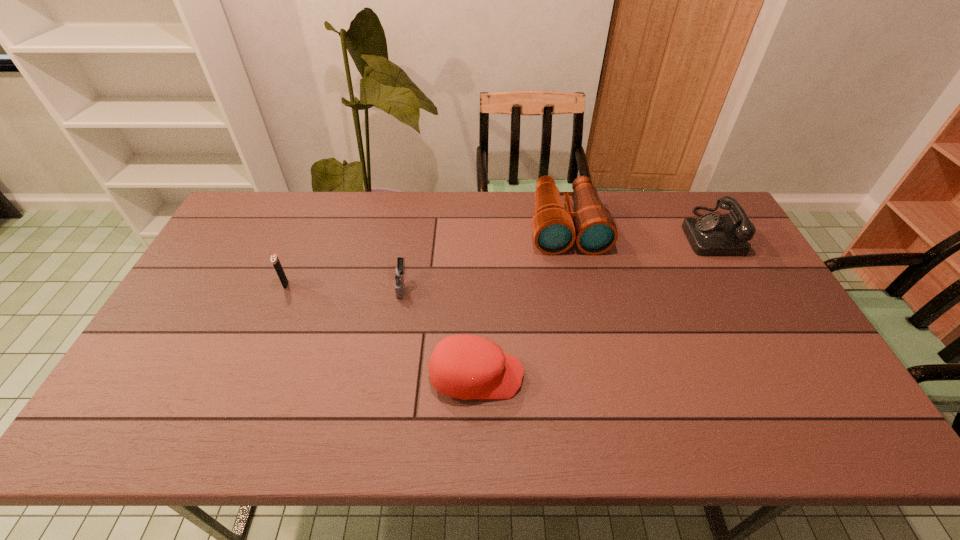
Image resolution: width=960 pixels, height=540 pixels. What are the coordinates of `vacant space situated 0.260m on the front of the leftmost object` in the screenshot? It's located at (252, 364).

The image size is (960, 540). Find the location of `vacant region located 0.190m on the back of the right igniter`. vacant region located 0.190m on the back of the right igniter is located at coordinates [411, 233].

Locate an element on the screen. free space located on the front-facing side of the nearest object is located at coordinates [543, 376].

You are a GUI agent. You are given a task and a screenshot of the screen. Output one action in this format:
    pyautogui.click(x=<x>, y=<y>)
    Task: Click on the binoculars at the far edge
    This screenshot has height=540, width=960.
    Given the screenshot: What is the action you would take?
    pyautogui.click(x=555, y=229)

Identify the location of telephone situated at the far edge. The width and height of the screenshot is (960, 540). (710, 234).

Where is `object positioned at the right edge`? object positioned at the right edge is located at coordinates (710, 234).

At what (x,y) coordinates should I click in order to perform the action: click on object positioned at the far right corner. Please return your answer as a coordinate pair (x, y). Looking at the image, I should click on (710, 234).

In the image, there is a desktop. Where is `vacant space at the far edge`? The height and width of the screenshot is (540, 960). vacant space at the far edge is located at coordinates (615, 208).

You are a GUI agent. You are given a task and a screenshot of the screen. Output one action in this format:
    pyautogui.click(x=<x>, y=<y>)
    Task: Click on the free space at the near edge
    
    Given the screenshot: What is the action you would take?
    pyautogui.click(x=455, y=423)

I want to click on free spot at the left edge of the desktop, so tap(206, 278).